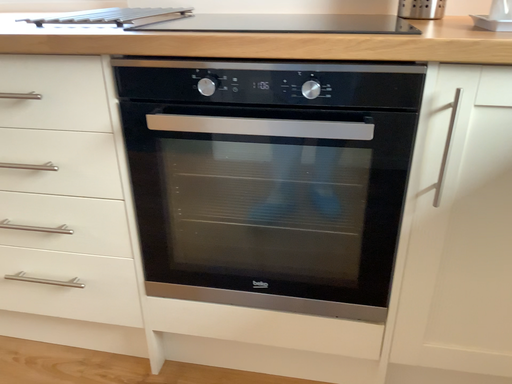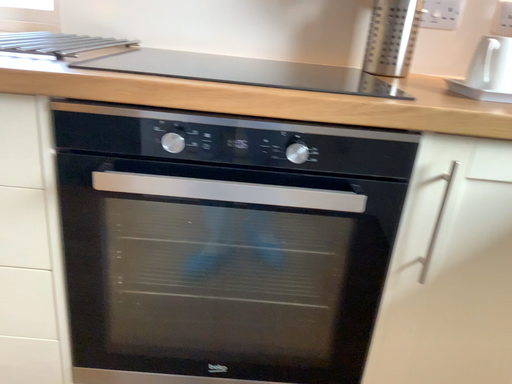
Question: How did the camera likely rotate when shooting the video?

Choices:
 (A) rotated right
 (B) rotated left

Answer: (A)